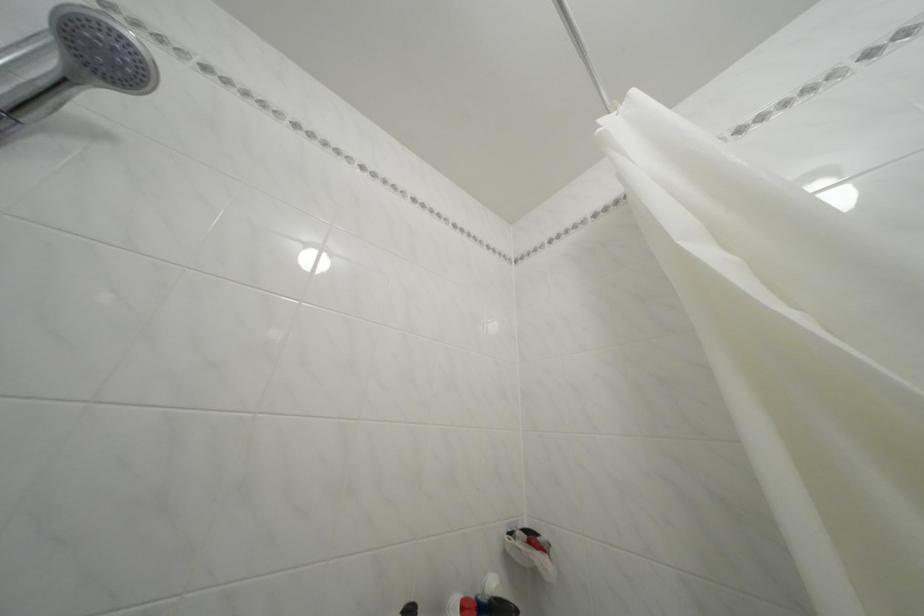
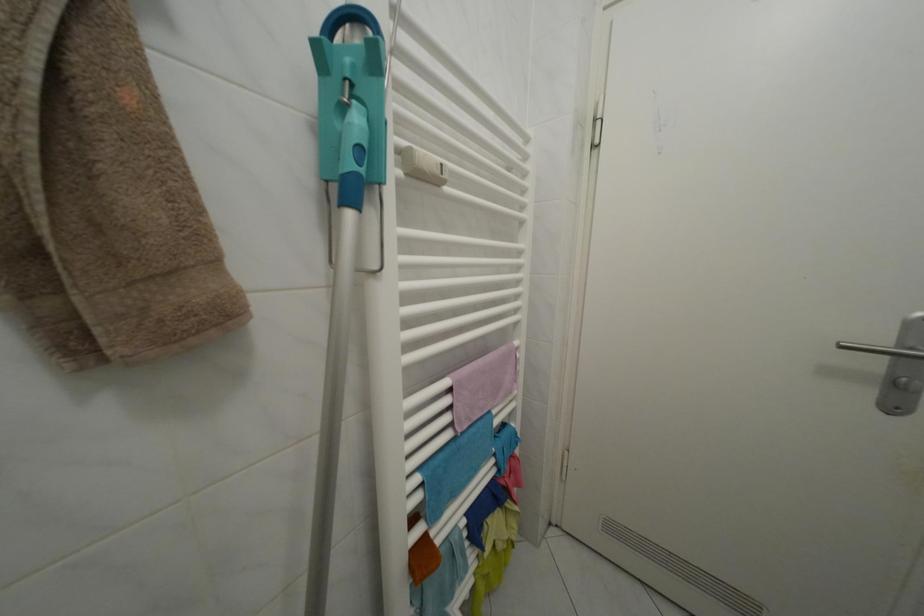
Question: Based on the continuous images, in which direction is the camera rotating? Reply with the corresponding letter.

Choices:
 (A) Left
 (B) Right
 (C) Up
 (D) Down

Answer: (B)